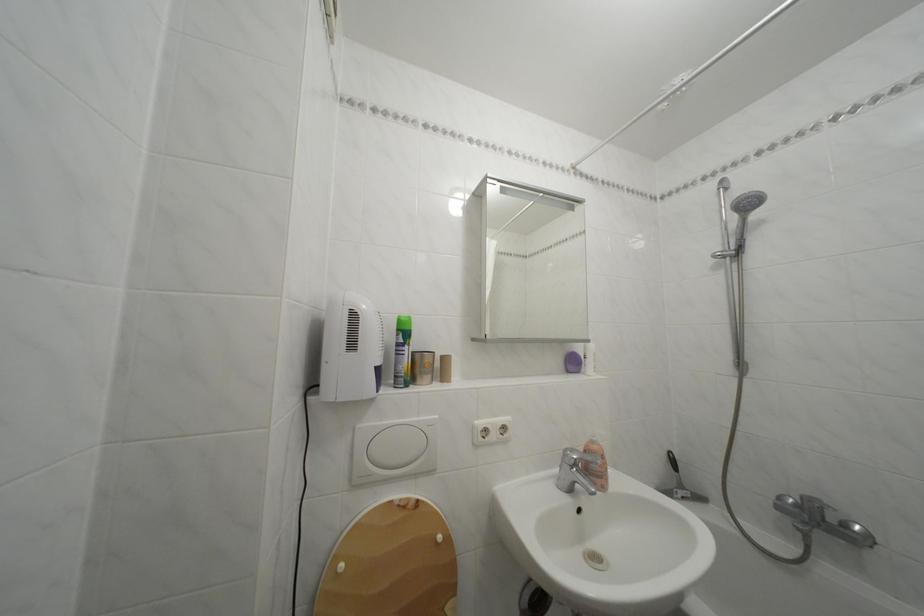
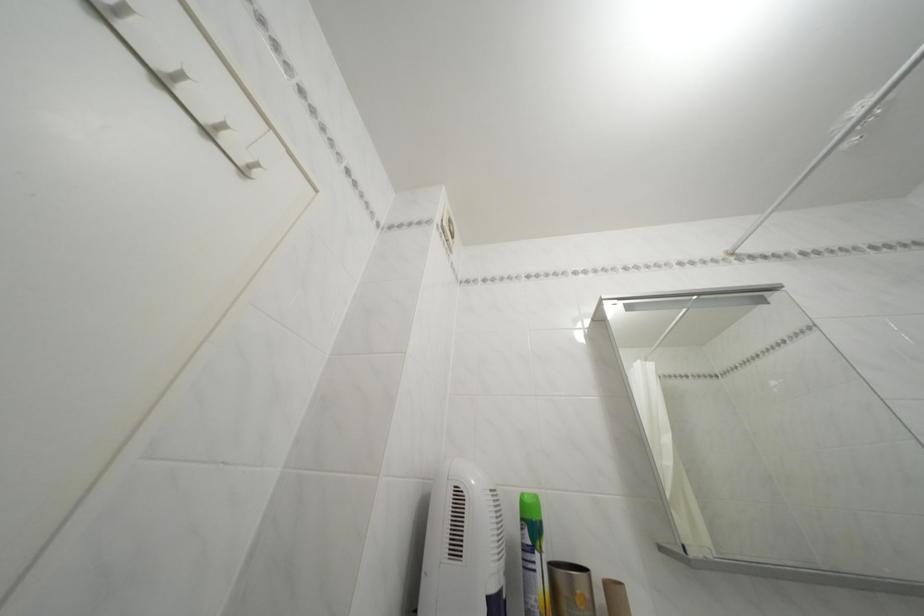
Find the pixel in the second image that matches pixel 451 363 in the first image.

(614, 591)